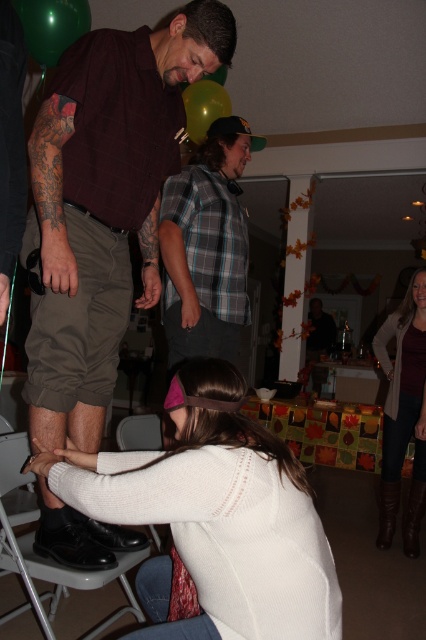
Does white knit sweater at lower center have a lesser width compared to black leather folding chair at lower center?

No.

Which is in front, point (190, 474) or point (74, 584)?

Point (190, 474)

Does point (282, 458) come closer to viewer compared to point (135, 611)?

Yes, it is in front of point (135, 611).

This screenshot has width=426, height=640. Identify the location of white knit sweater at lower center. (215, 525).

Is white knit sweater at lower center bigger than green rubber balloon at upper center?

Correct, white knit sweater at lower center is larger in size than green rubber balloon at upper center.

Is white knit sweater at lower center in front of green rubber balloon at upper center?

Yes, it is in front of green rubber balloon at upper center.

Which is behind, point (83, 508) or point (212, 109)?

Point (212, 109)

The width and height of the screenshot is (426, 640). I want to click on white knit sweater at lower center, so (215, 525).

Can you confirm if matte black shoe at lower left is positioned below brown leather boots at lower right?

No.

Who is more forward, [92,524] or [391,454]?

Point [92,524] is in front.

Find the location of a particular element. The image size is (426, 640). matte black shoe at lower left is located at coordinates (103, 204).